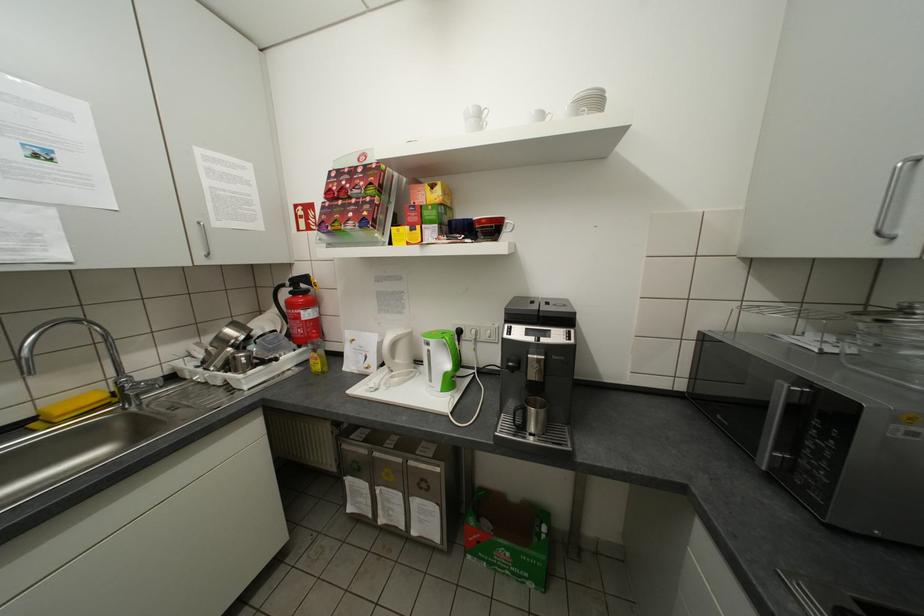
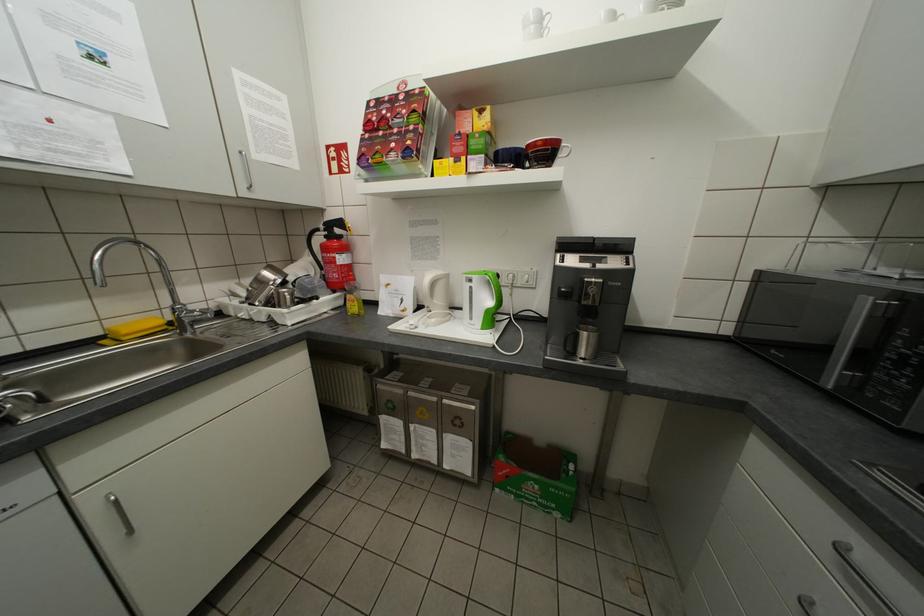
Locate, in the second image, the point that corresponds to the point at 209,253 in the first image.

(251, 185)